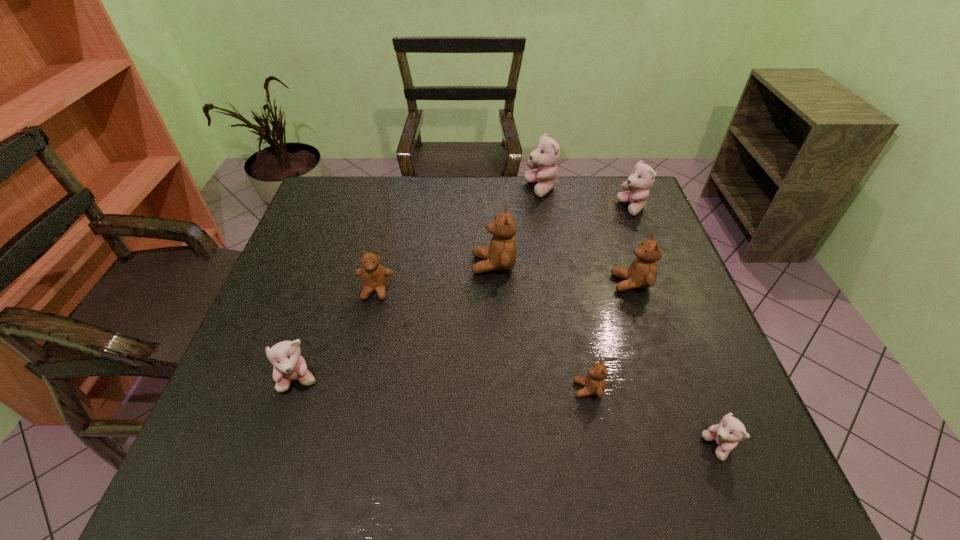
What are the coordinates of `vacant space located 0.370m at the face of the nearest pink teddy bear` in the screenshot? It's located at (509, 448).

At what (x,y) coordinates should I click in order to perform the action: click on free space located 0.170m at the face of the nearest pink teddy bear. Please return your answer as a coordinate pair (x, y). Looking at the image, I should click on (614, 448).

Find the location of a particular element. Image resolution: width=960 pixels, height=540 pixels. vacant space located at the face of the nearest pink teddy bear is located at coordinates (566, 448).

The height and width of the screenshot is (540, 960). Find the location of `object that is at the near edge`. object that is at the near edge is located at coordinates (726, 434).

You are a GUI agent. You are given a task and a screenshot of the screen. Output one action in this format:
    pyautogui.click(x=<x>, y=<y>)
    Task: Click on the object situated at the left edge
    This screenshot has width=960, height=540.
    Given the screenshot: What is the action you would take?
    pyautogui.click(x=289, y=365)

Locate an element on the screen. The width and height of the screenshot is (960, 540). object located at the far right corner is located at coordinates (642, 177).

Image resolution: width=960 pixels, height=540 pixels. Find the location of `object situated at the near right corner`. object situated at the near right corner is located at coordinates (726, 434).

Image resolution: width=960 pixels, height=540 pixels. I want to click on free space at the far edge of the desktop, so click(487, 193).

Where is `free space at the near edge of the desktop`? Image resolution: width=960 pixels, height=540 pixels. free space at the near edge of the desktop is located at coordinates (348, 482).

In the image, there is a desktop. Identify the location of vacant space at the left edge. (261, 314).